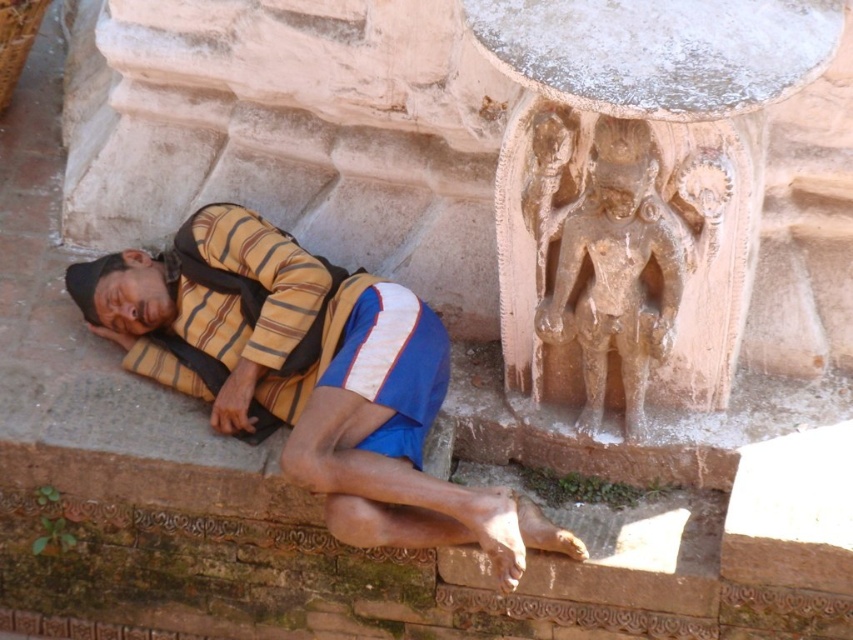
You are an architect assessing the proportions of the carved stone figure at upper center and the yellow striped shirt at left in the image. Which object has a smaller width?

The carved stone figure at upper center has a smaller width than the yellow striped shirt at left.

You are a photographer trying to capture the two points in the image. Which point, point (613, 83) or point (585, 195), will appear larger in your photo?

Point (613, 83) is closer to the viewer than point (585, 195), so it will appear larger in the photo.